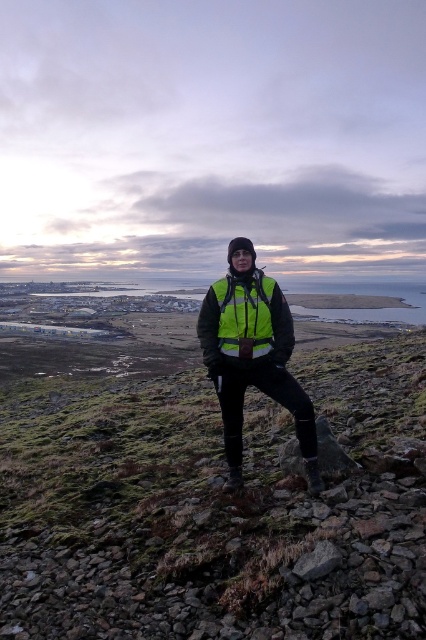
Looking at this image, does neon yellow reflective vest at center have a greater width compared to high visibility fabric safety vest at center?

Yes, neon yellow reflective vest at center is wider than high visibility fabric safety vest at center.

Between point (252, 349) and point (245, 337), which one is positioned in front?

Point (252, 349) is in front.

Locate an element on the screen. The image size is (426, 640). neon yellow reflective vest at center is located at coordinates (253, 355).

Is reflective green vest at center to the right of high visibility fabric safety vest at center from the viewer's perspective?

Correct, you'll find reflective green vest at center to the right of high visibility fabric safety vest at center.

Who is taller, reflective green vest at center or high visibility fabric safety vest at center?

reflective green vest at center is taller.

Is point (224, 468) positioned behind point (226, 310)?

Yes, it is behind point (226, 310).

This screenshot has width=426, height=640. I want to click on reflective green vest at center, so click(x=213, y=508).

Is reflective green vest at center positioned in front of neon yellow reflective vest at center?

That is True.

Between reflective green vest at center and neon yellow reflective vest at center, which one appears on the left side from the viewer's perspective?

neon yellow reflective vest at center

Who is more distant from viewer, (336,627) or (253,272)?

Positioned behind is point (253,272).

At what (x,y) coordinates should I click in order to perform the action: click on reflective green vest at center. Please return your answer as a coordinate pair (x, y). This screenshot has width=426, height=640. Looking at the image, I should click on (213, 508).